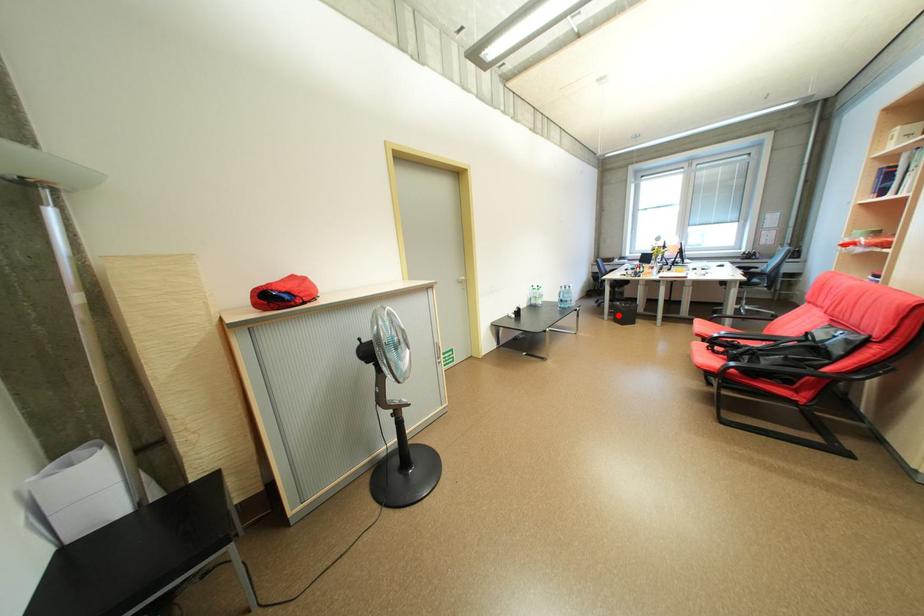
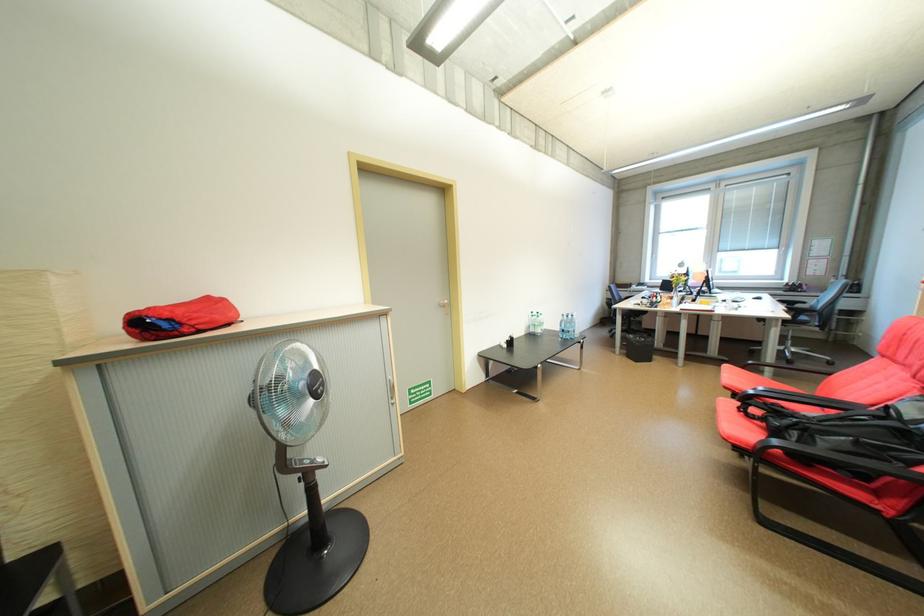
In the second image, find the point that corresponds to the highlighted location in the first image.

(630, 349)